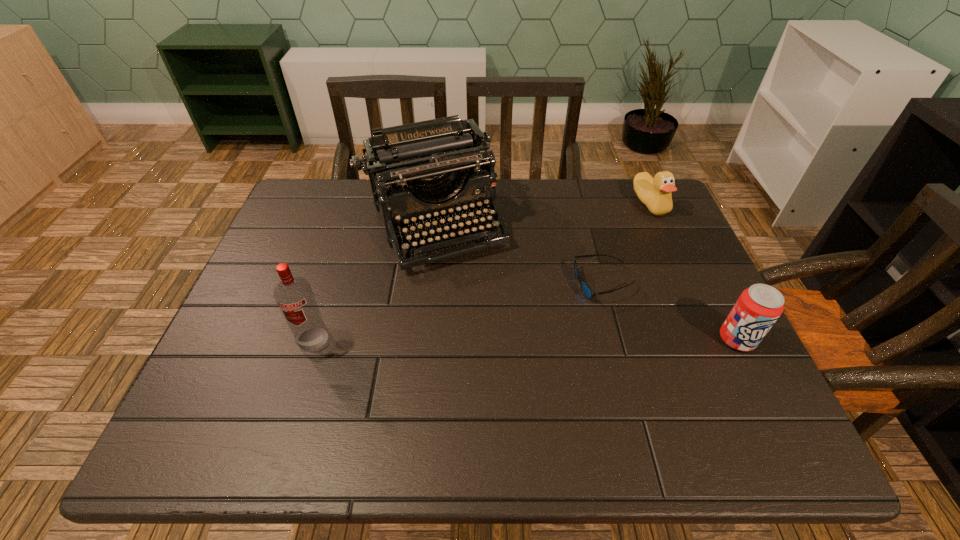
This screenshot has height=540, width=960. Identify the location of vodka. (294, 296).

In order to click on soda can in this screenshot , I will do `click(758, 307)`.

The width and height of the screenshot is (960, 540). I want to click on duck, so click(x=655, y=193).

The height and width of the screenshot is (540, 960). I want to click on typewriter, so click(422, 161).

This screenshot has height=540, width=960. I want to click on sunglasses, so click(587, 291).

This screenshot has height=540, width=960. Find the location of `the shortest object`. the shortest object is located at coordinates (587, 291).

This screenshot has height=540, width=960. Find the location of `free location located on the front label of the vodka`. free location located on the front label of the vodka is located at coordinates (296, 394).

I want to click on free region located 0.260m at the beak of the second shortest object, so click(x=616, y=272).

Where is `vacant space situated 0.090m at the beak of the second shortest object`? vacant space situated 0.090m at the beak of the second shortest object is located at coordinates (637, 235).

The height and width of the screenshot is (540, 960). I want to click on blank area located at the beak of the second shortest object, so click(x=615, y=274).